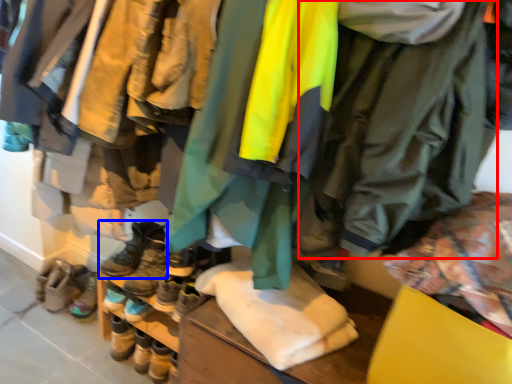
Question: Which object appears farthest to the camera in this image, jacket (highlighted by a red box) or footwear (highlighted by a blue box)?

Choices:
 (A) jacket
 (B) footwear

Answer: (B)